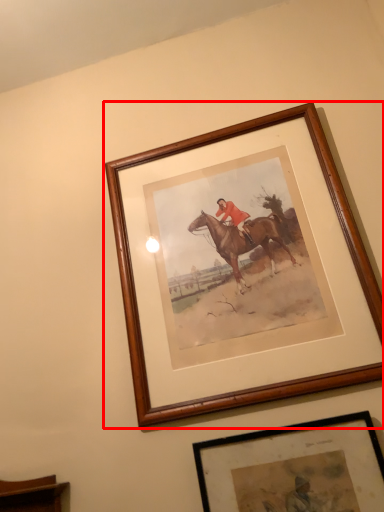
Question: From the image's perspective, what is the correct spatial relationship of picture frame (annotated by the red box) in relation to picture frame?

Choices:
 (A) above
 (B) below

Answer: (A)